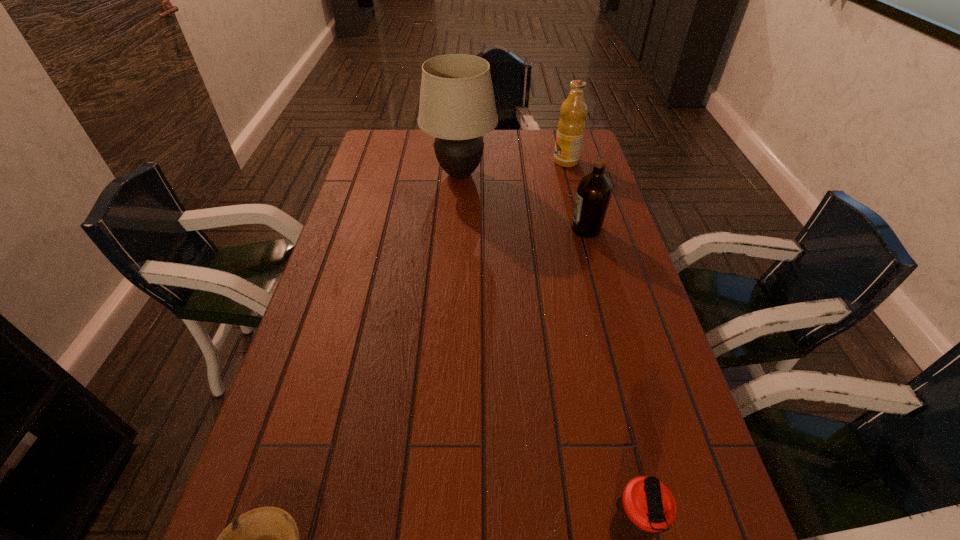
Where is `lampshade`? The image size is (960, 540). lampshade is located at coordinates (457, 106).

Find the location of a particular element. The height and width of the screenshot is (540, 960). the tallest object is located at coordinates (457, 106).

The height and width of the screenshot is (540, 960). Find the location of `the taller olive oil`. the taller olive oil is located at coordinates (571, 127).

In order to click on the farther olive oil in this screenshot , I will do `click(571, 127)`.

Locate an element on the screen. The image size is (960, 540). the third farthest object is located at coordinates (593, 193).

This screenshot has width=960, height=540. Identify the location of the shorter olive oil. (593, 193).

Identify the location of blank space located on the right of the second object from left to right. The width and height of the screenshot is (960, 540). (542, 174).

Locate an element on the screen. The image size is (960, 540). vacant region located 0.320m on the label of the farther olive oil is located at coordinates (466, 161).

Find the location of a particular element. blank space located on the label of the farther olive oil is located at coordinates (485, 161).

I want to click on vacant region located on the label of the farther olive oil, so click(529, 161).